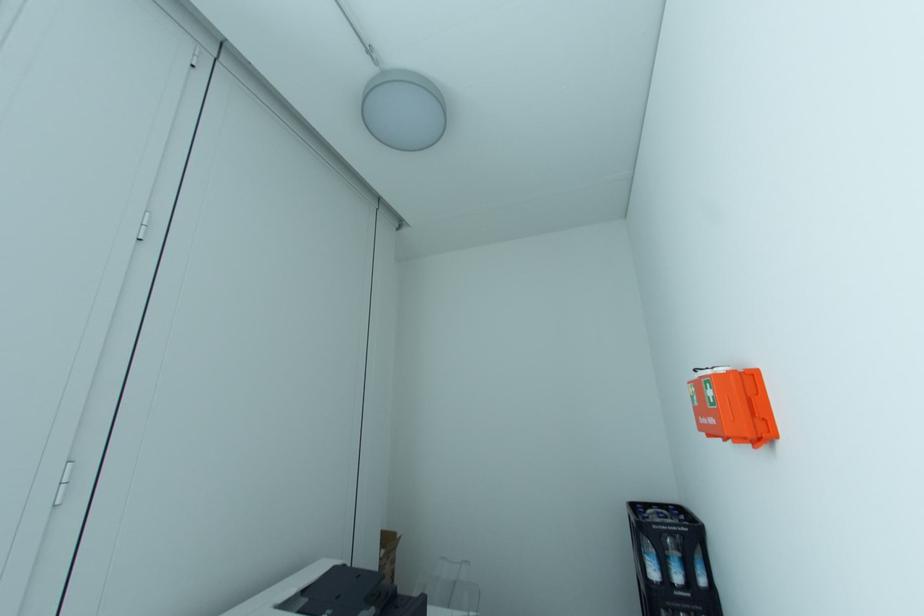
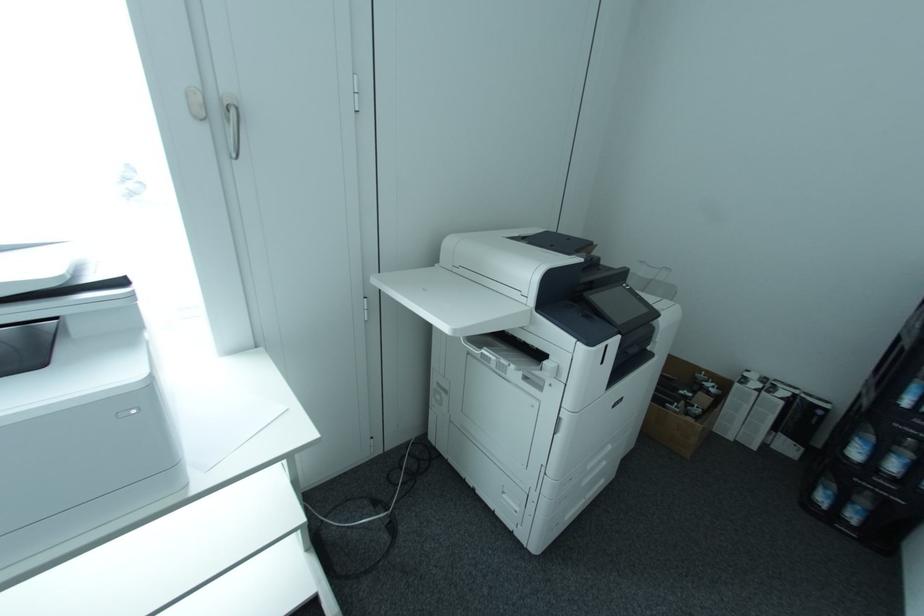
First-person continuous shooting, in which direction is the camera rotating?

The rotation direction of the camera is left-down.